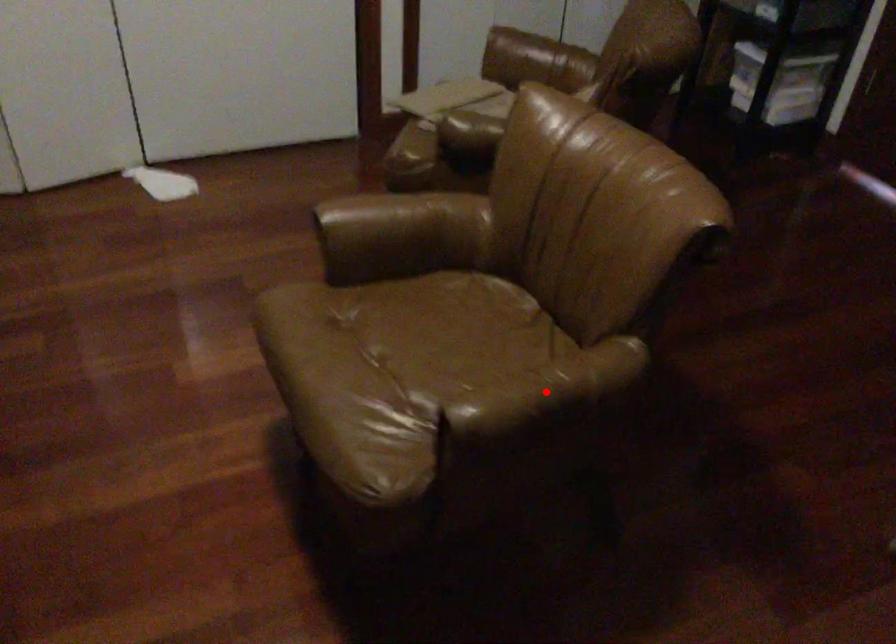
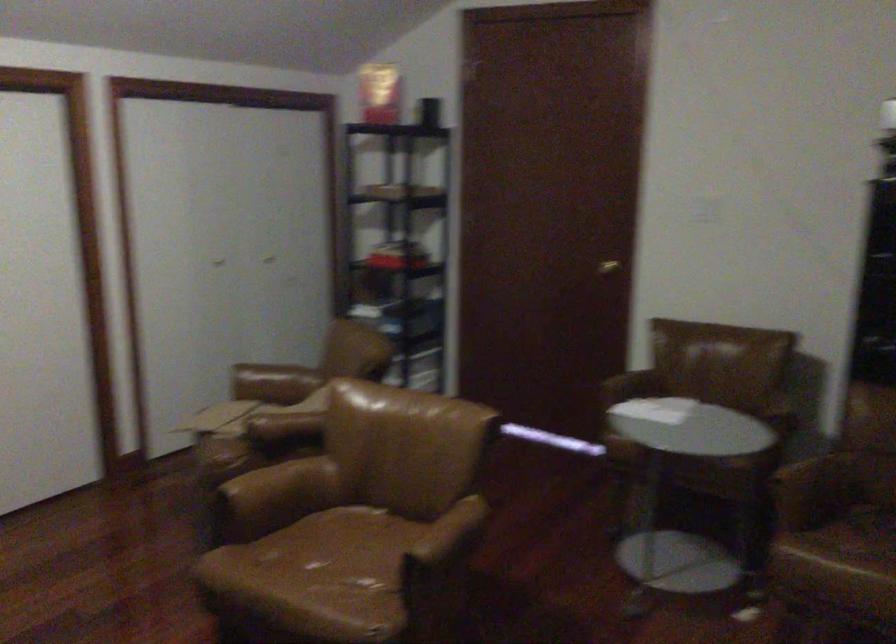
Locate, in the second image, the point that corresponds to the highlighted location in the first image.

(448, 536)